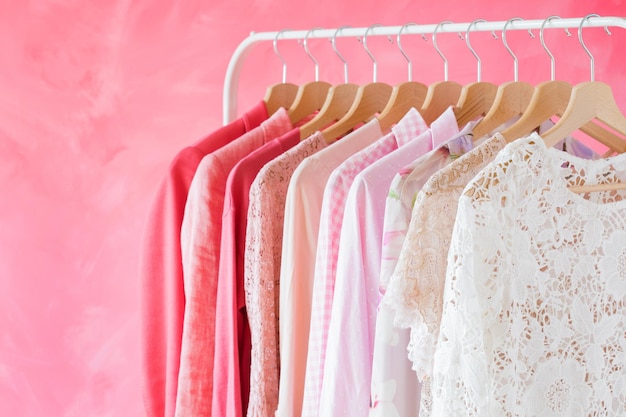
At what (x,y) coordinates should I click in order to perform the action: click on wooden clothes hangers. Please return your answer as a coordinate pair (x, y). The width and height of the screenshot is (626, 417). Looking at the image, I should click on (284, 90), (315, 90), (342, 92), (379, 92), (409, 92), (447, 92), (483, 93), (516, 94), (550, 95), (592, 94).